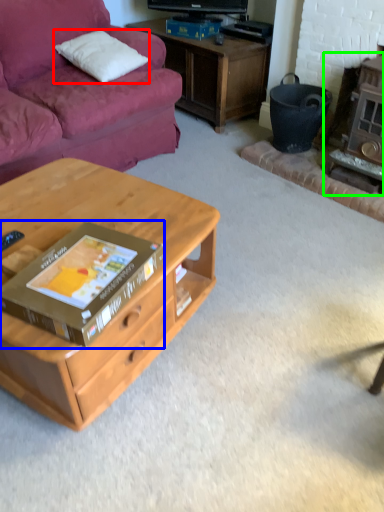
Question: Considering the real-world distances, which object is farthest from pillow (highlighted by a red box)? box (highlighted by a blue box) or fireplace (highlighted by a green box)?

Choices:
 (A) box
 (B) fireplace

Answer: (A)